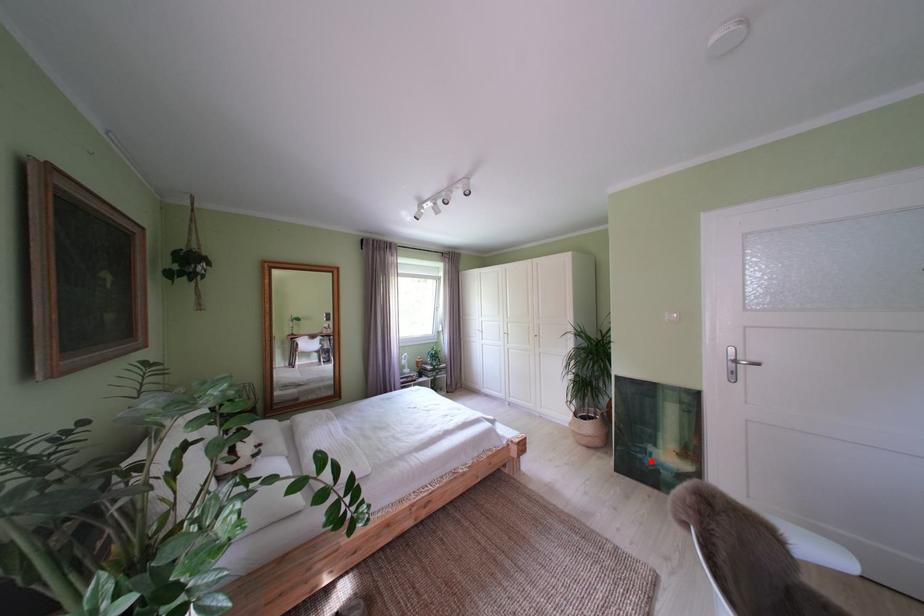
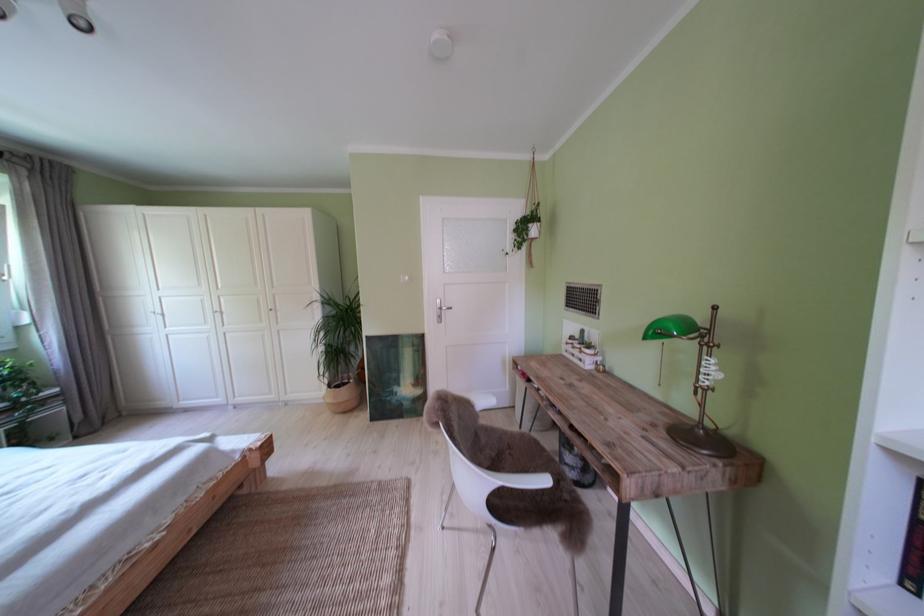
Where in the second image is the point corresponding to the highlighted location from the first image?

(399, 403)